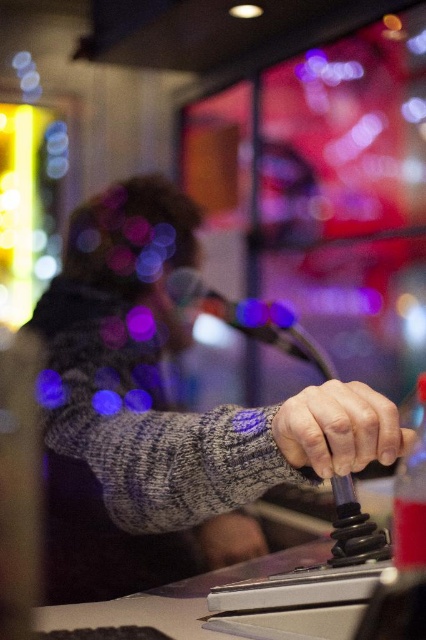
Question: Is gray knitted sweater at center bigger than smooth gray hand at center?

Choices:
 (A) no
 (B) yes

Answer: (B)

Question: Can you confirm if gray knitted sweater at center is positioned to the left of smooth gray hand at center?

Choices:
 (A) yes
 (B) no

Answer: (A)

Question: Among these points, which one is nearest to the camera?

Choices:
 (A) (359, 456)
 (B) (109, 481)

Answer: (A)

Question: Among these points, which one is nearest to the camera?

Choices:
 (A) (129, 289)
 (B) (360, 410)

Answer: (B)

Question: Does gray knitted sweater at center have a larger size compared to smooth gray hand at center?

Choices:
 (A) no
 (B) yes

Answer: (B)